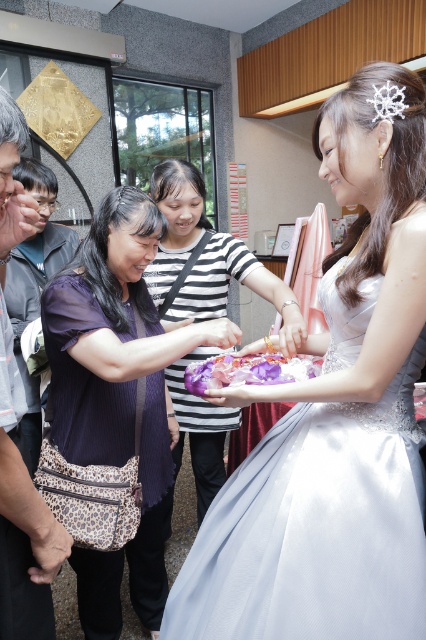
From the picture: Is leather jacket at left to the right of white lace tiara at upper center from the viewer's perspective?

In fact, leather jacket at left is to the left of white lace tiara at upper center.

Where is `leather jacket at left`? This screenshot has width=426, height=640. leather jacket at left is located at coordinates (14, 428).

Who is more forward, (x=5, y=316) or (x=388, y=90)?

Point (x=5, y=316)

At what (x,y) coordinates should I click in order to perform the action: click on leather jacket at left. Please return your answer as a coordinate pair (x, y). This screenshot has height=640, width=426. Looking at the image, I should click on (14, 428).

Between purple sheer dress at center and white lace tiara at upper center, which one appears on the right side from the viewer's perspective?

white lace tiara at upper center is more to the right.

Can you confirm if purple sheer dress at center is positioned to the left of white lace tiara at upper center?

Correct, you'll find purple sheer dress at center to the left of white lace tiara at upper center.

Locate an element on the screen. This screenshot has width=426, height=640. purple sheer dress at center is located at coordinates (118, 394).

Who is more distant from viewer, [103,228] or [198,476]?

The point [198,476] is more distant.

Who is positioned more to the left, purple sheer dress at center or striped fabric dress at center?

purple sheer dress at center is more to the left.

Is point (150, 234) less distant than point (199, 273)?

Yes, it is in front of point (199, 273).

Where is `purple sheer dress at center`? This screenshot has width=426, height=640. purple sheer dress at center is located at coordinates (118, 394).